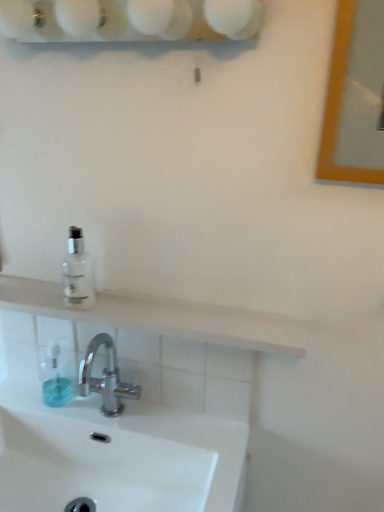
At what (x,y) coordinates should I click in order to perform the action: click on vacant space to the right of transparent glass bottle at upper left. Please return your answer as a coordinate pair (x, y). The image size is (384, 512). Looking at the image, I should click on (147, 306).